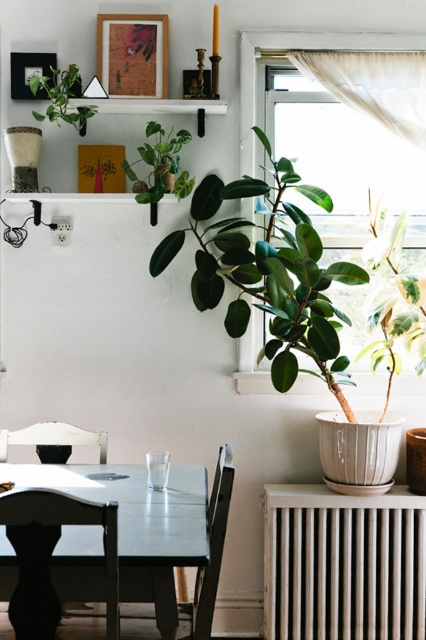
You are a painter standing at the edge of the room where the black wood chair at lower left is located. You want to paint the transparent fabric at upper right without moving your position. Can you reach it with your 2.5 meter long paintbrush?

The black wood chair at lower left is 3.12 meters from the transparent fabric at upper right. Since your paintbrush is only 2.5 meters long, you cannot reach the transparent fabric at upper right from your current position.

You are a guest in this room and want to sit down. You see the black wood chair at lower left and the transparent fabric at upper right. Which one is a better option for sitting?

The black wood chair at lower left is shorter than the transparent fabric at upper right, so the black wood chair at lower left is a better option for sitting since it is designed for seating and at a suitable height.